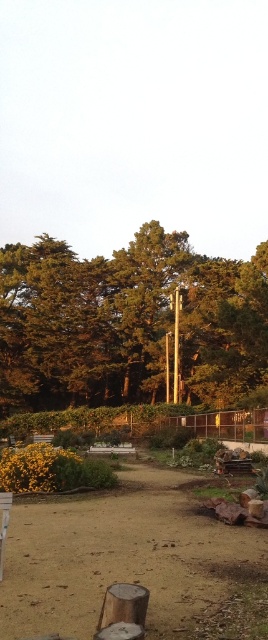
Question: Which object is farther from the camera taking this photo?

Choices:
 (A) brown sandy dirt at center
 (B) green leafy tree at center

Answer: (B)

Question: Is green leafy tree at center bigger than brown sandy dirt at center?

Choices:
 (A) no
 (B) yes

Answer: (B)

Question: Does green leafy tree at center appear over brown sandy dirt at center?

Choices:
 (A) no
 (B) yes

Answer: (B)

Question: Which of the following is the farthest from the observer?

Choices:
 (A) (199, 637)
 (B) (199, 346)

Answer: (B)

Question: Is green leafy tree at center further to camera compared to brown sandy dirt at center?

Choices:
 (A) yes
 (B) no

Answer: (A)